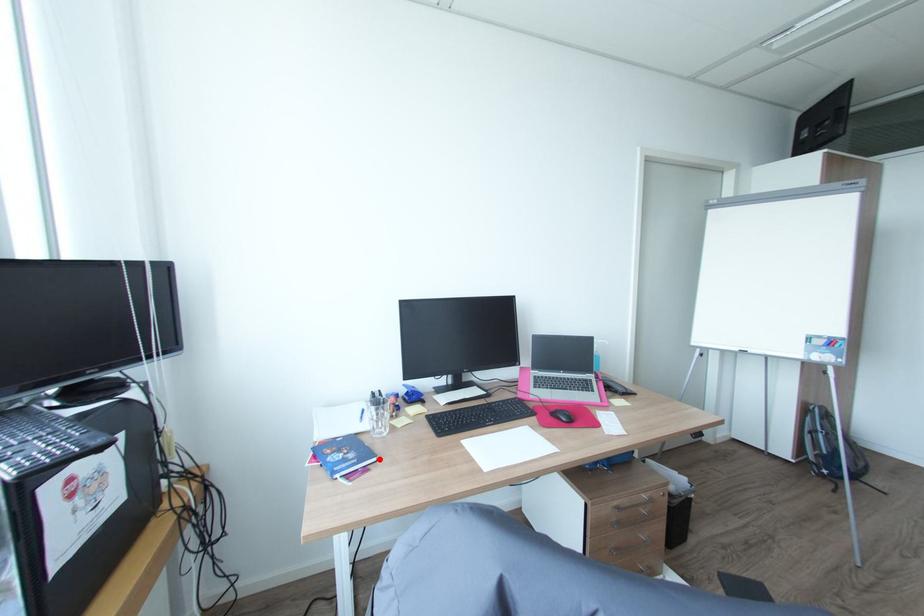
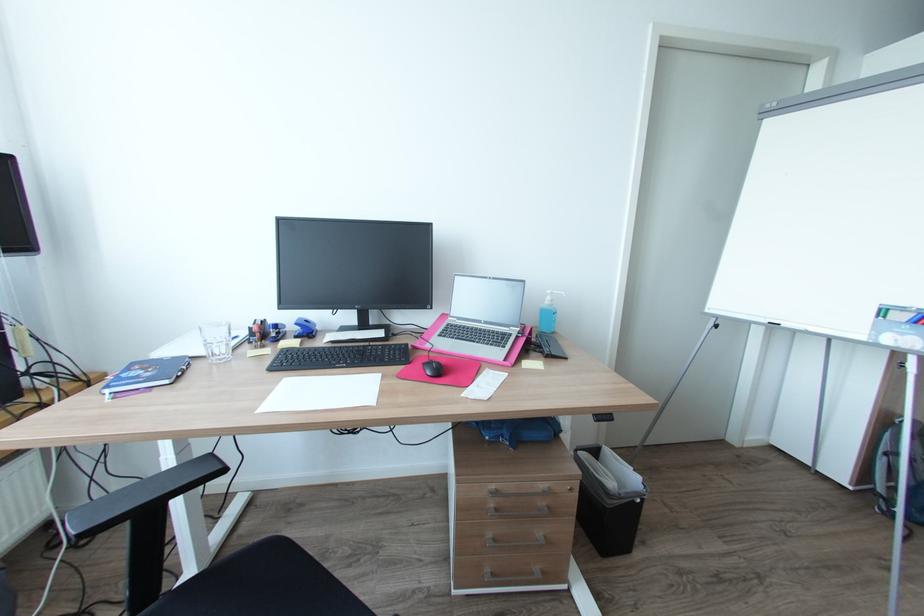
Find the pixel in the second image that matches the highlighted location in the first image.

(171, 381)